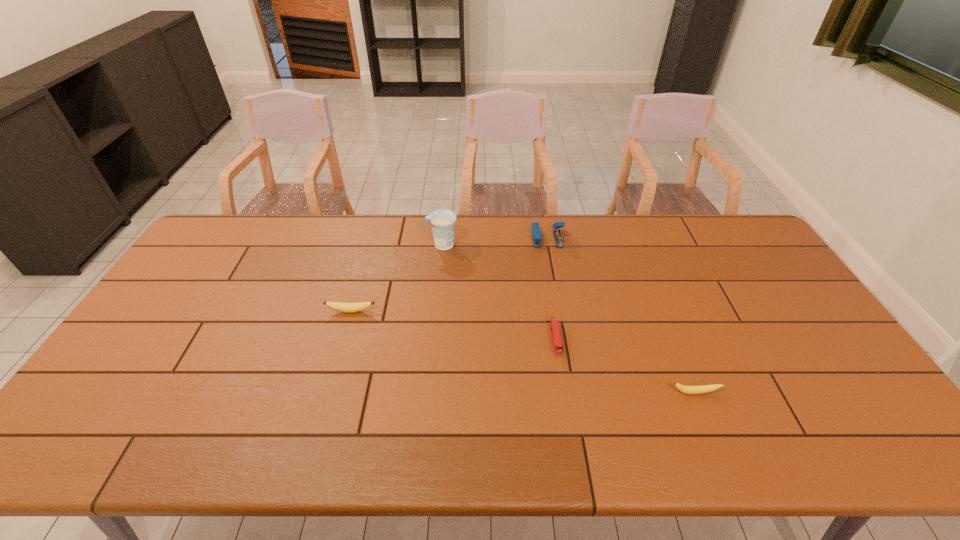
Find the location of `vacant space at the far left corner of the desktop`. vacant space at the far left corner of the desktop is located at coordinates (242, 247).

This screenshot has width=960, height=540. What are the coordinates of `free space between the fourth object from right to left and the farther stapler` in the screenshot? It's located at (494, 241).

This screenshot has width=960, height=540. I want to click on free space between the yogurt and the nearer stapler, so click(x=498, y=292).

You are a GUI agent. You are given a task and a screenshot of the screen. Output one action in this format:
    pyautogui.click(x=<x>, y=<y>)
    Task: Click on the free area in between the tallest object and the second nearest object
    This screenshot has height=540, width=960.
    Given the screenshot: What is the action you would take?
    pyautogui.click(x=498, y=292)

Identify the location of free spot between the fourth farthest object and the yogurt. The width and height of the screenshot is (960, 540). (498, 292).

Where is `vacant region between the rightmost object and the nearer stapler`? This screenshot has height=540, width=960. vacant region between the rightmost object and the nearer stapler is located at coordinates [625, 366].

Identify the location of free spot between the left banana and the second object from left to right. (396, 278).

Where is `free space between the tallest object and the shorter stapler`? free space between the tallest object and the shorter stapler is located at coordinates (498, 292).

What are the coordinates of `free area in between the rightmost object and the fourth object from right to left` in the screenshot? It's located at (568, 319).

This screenshot has width=960, height=540. I want to click on free spot between the second object from left to right and the nearest object, so click(x=568, y=319).